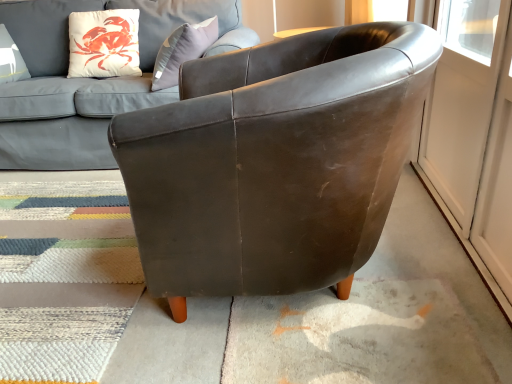
Question: Is the position of matte leather couch at upper center more distant than that of white glossy screen door at right?

Choices:
 (A) yes
 (B) no

Answer: (A)

Question: Is matte leather couch at upper center at the right side of white glossy screen door at right?

Choices:
 (A) yes
 (B) no

Answer: (B)

Question: Can you confirm if matte leather couch at upper center is smaller than white glossy screen door at right?

Choices:
 (A) yes
 (B) no

Answer: (B)

Question: Is matte leather couch at upper center thinner than white glossy screen door at right?

Choices:
 (A) no
 (B) yes

Answer: (A)

Question: Is matte leather couch at upper center placed right next to white glossy screen door at right?

Choices:
 (A) yes
 (B) no

Answer: (B)

Question: Is white glossy screen door at right completely or partially inside matte leather couch at upper center?

Choices:
 (A) yes
 (B) no

Answer: (B)

Question: Considering the relative positions of leather chair at center and white glossy screen door at right in the image provided, is leather chair at center to the right of white glossy screen door at right from the viewer's perspective?

Choices:
 (A) no
 (B) yes

Answer: (A)

Question: Does leather chair at center have a larger size compared to white glossy screen door at right?

Choices:
 (A) no
 (B) yes

Answer: (B)

Question: From the image's perspective, is leather chair at center under white glossy screen door at right?

Choices:
 (A) yes
 (B) no

Answer: (A)

Question: Is leather chair at center far away from white glossy screen door at right?

Choices:
 (A) no
 (B) yes

Answer: (A)

Question: Can we say leather chair at center lies outside white glossy screen door at right?

Choices:
 (A) no
 (B) yes

Answer: (B)

Question: Is white glossy screen door at right a part of leather chair at center?

Choices:
 (A) yes
 (B) no

Answer: (B)

Question: Are leather chair at center and textured wool mat at lower left far apart?

Choices:
 (A) yes
 (B) no

Answer: (B)